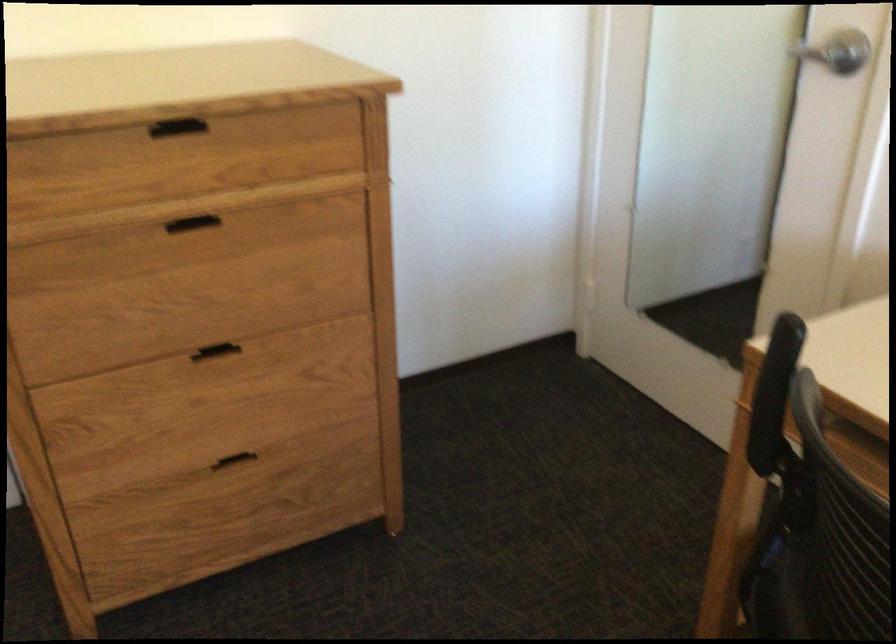
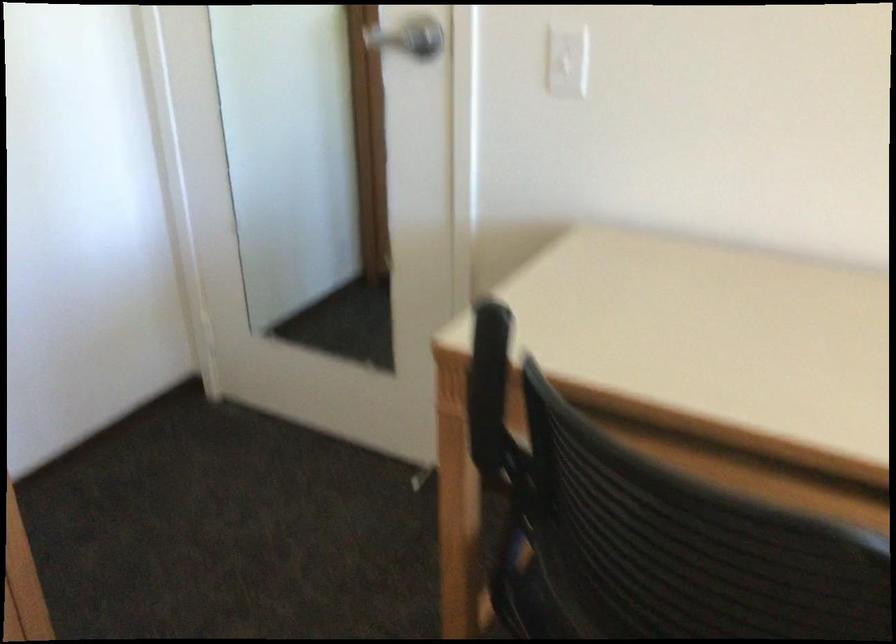
Question: The first image is from the beginning of the video and the second image is from the end. How did the camera likely rotate when shooting the video?

Choices:
 (A) Left
 (B) Right
 (C) Up
 (D) Down

Answer: (B)